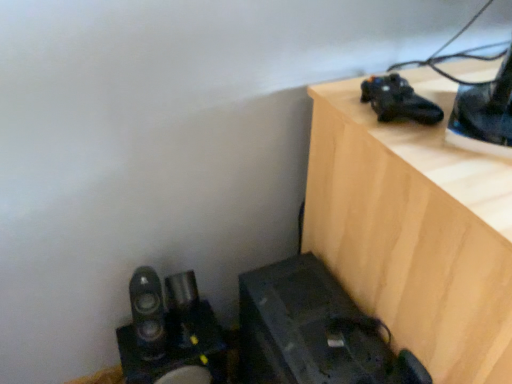
Locate an element on the screen. This screenshot has height=384, width=512. vacant region to the left of black matte shoe at upper right is located at coordinates (352, 104).